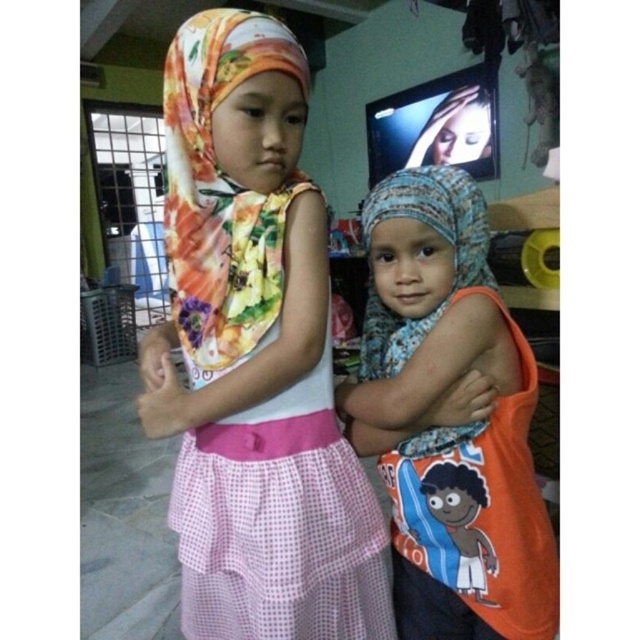
Question: Which object is positioned closest to the floral fabric hijab at upper left?

Choices:
 (A) blue printed scarf at center
 (B) smooth skin face at upper right

Answer: (A)

Question: Observing the image, what is the correct spatial positioning of floral fabric hijab at upper left in reference to blue printed scarf at center?

Choices:
 (A) left
 (B) right

Answer: (A)

Question: Considering the real-world distances, which object is closest to the blue printed scarf at center?

Choices:
 (A) smooth skin face at upper right
 (B) floral fabric hijab at upper left

Answer: (B)

Question: Does floral fabric hijab at upper left appear on the left side of smooth skin face at upper right?

Choices:
 (A) yes
 (B) no

Answer: (A)

Question: Which of the following is the farthest from the observer?

Choices:
 (A) blue printed scarf at center
 (B) floral fabric hijab at upper left
 (C) smooth skin face at upper right

Answer: (C)

Question: Does blue printed scarf at center have a greater width compared to smooth skin face at upper right?

Choices:
 (A) no
 (B) yes

Answer: (A)